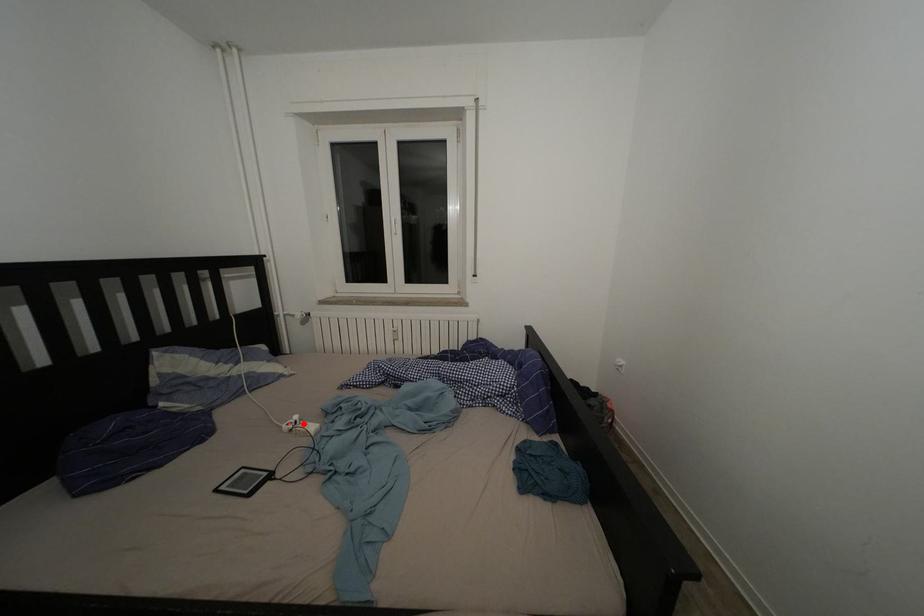
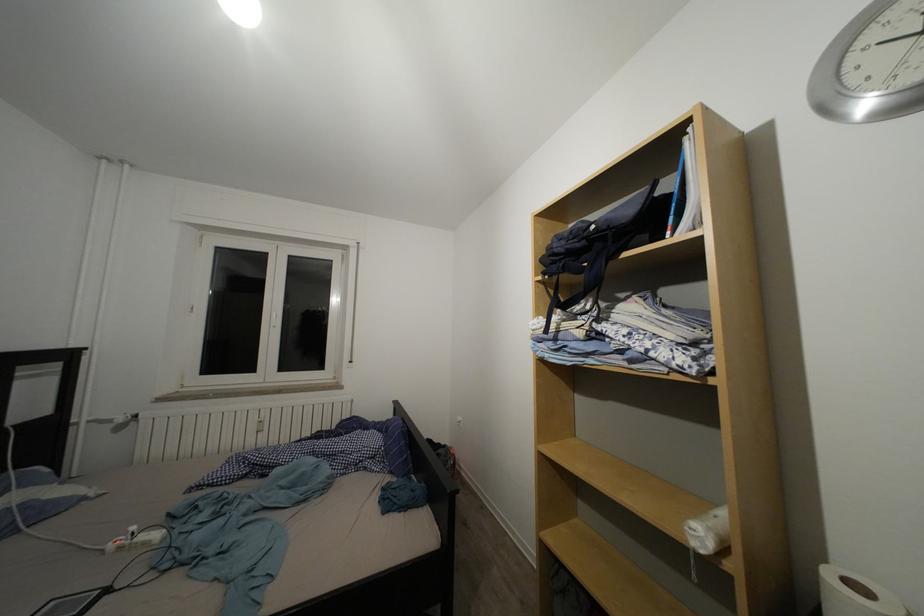
The point at the highlighted location is marked in the first image. Where is the corresponding point in the second image?

(140, 533)